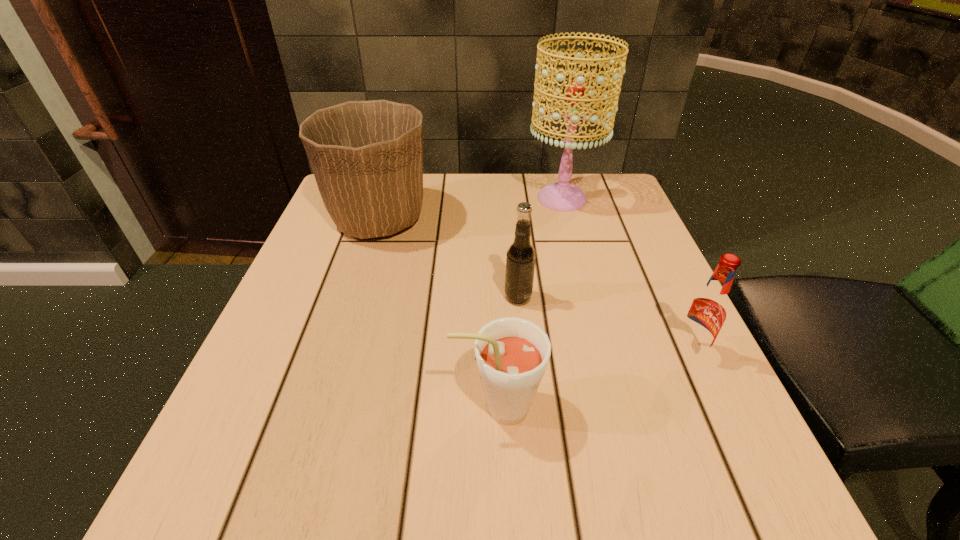
Where is `lampshade located at the right edge`? The height and width of the screenshot is (540, 960). lampshade located at the right edge is located at coordinates (561, 196).

The image size is (960, 540). What are the coordinates of `root beer that is at the right edge` in the screenshot? It's located at (706, 313).

At what (x,y) coordinates should I click in order to perform the action: click on object that is positioned at the far left corner. Please return your answer as a coordinate pair (x, y). Image resolution: width=960 pixels, height=540 pixels. Looking at the image, I should click on pos(367,156).

Find the location of a particular element. The width and height of the screenshot is (960, 540). object that is at the far right corner is located at coordinates (561, 196).

Find the location of a particular element. The width and height of the screenshot is (960, 540). vacant position at the far edge of the desktop is located at coordinates (426, 210).

In the image, there is a desktop. At what (x,y) coordinates should I click in order to perform the action: click on free region at the near edge. Please return your answer as a coordinate pair (x, y). Looking at the image, I should click on (363, 488).

In the image, there is a desktop. Where is `free space at the left edge`? free space at the left edge is located at coordinates (330, 320).

The width and height of the screenshot is (960, 540). I want to click on free space at the right edge, so click(x=632, y=421).

Image resolution: width=960 pixels, height=540 pixels. Find the location of `free space at the near left corner`. free space at the near left corner is located at coordinates (276, 524).

In the image, there is a desktop. Where is `free space at the far right corner`? The height and width of the screenshot is (540, 960). free space at the far right corner is located at coordinates (629, 220).